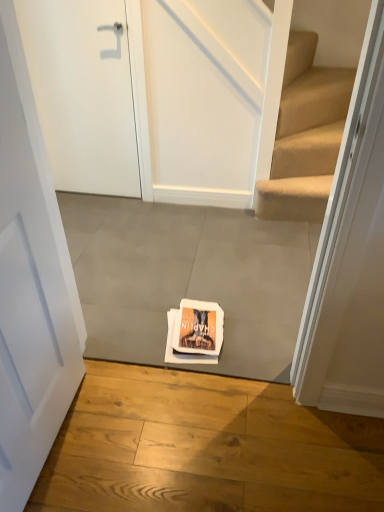
Where is `white matte door at center, which appears as the first door when ordered from the bottom`? The height and width of the screenshot is (512, 384). white matte door at center, which appears as the first door when ordered from the bottom is located at coordinates (31, 286).

Identify the location of white matte door at upper left, placed as the second door when sorted from front to back. [83, 92].

The height and width of the screenshot is (512, 384). I want to click on gray concrete at center, marked as the 1th concrete in a front-to-back arrangement, so click(205, 447).

Can you confirm if gray concrete at center, acting as the first concrete starting from the bottom, is wider than white matte door at center, which is counted as the first door, starting from the front?

Indeed, gray concrete at center, acting as the first concrete starting from the bottom, has a greater width compared to white matte door at center, which is counted as the first door, starting from the front.

In the scene shown: Can you confirm if gray concrete at center, the second concrete when ordered from back to front, is shorter than white matte door at center, which is counted as the first door, starting from the front?

Indeed, gray concrete at center, the second concrete when ordered from back to front, has a lesser height compared to white matte door at center, which is counted as the first door, starting from the front.

How different are the orientations of gray concrete at center, the second concrete when ordered from back to front, and white matte door at center, acting as the 2th door starting from the back, in degrees?

gray concrete at center, the second concrete when ordered from back to front, and white matte door at center, acting as the 2th door starting from the back, are facing 91.7 degrees away from each other.

From a real-world perspective, is gray concrete at center, the 2th concrete in the bottom-to-top sequence, physically located above or below gray concrete at center, acting as the first concrete starting from the bottom?

gray concrete at center, the 2th concrete in the bottom-to-top sequence, is above gray concrete at center, acting as the first concrete starting from the bottom.

Based on their sizes in the image, would you say gray concrete at center, acting as the 1th concrete starting from the back, is bigger or smaller than gray concrete at center, the second concrete when ordered from back to front?

gray concrete at center, acting as the 1th concrete starting from the back, is bigger than gray concrete at center, the second concrete when ordered from back to front.

Is point (293, 302) closer or farther from the camera than point (137, 489)?

Point (293, 302) is farther from the camera than point (137, 489).

Who is taller, white matte door at center, the second door viewed from the top, or gray concrete at center, acting as the 1th concrete starting from the back?

Standing taller between the two is white matte door at center, the second door viewed from the top.

Between white matte door at center, the second door viewed from the top, and gray concrete at center, acting as the 1th concrete starting from the back, which one has smaller width?

white matte door at center, the second door viewed from the top, is thinner.

Considering the sizes of objects white matte door at center, acting as the 2th door starting from the back, and white matte door at upper left, the first door positioned from the back, in the image provided, who is shorter, white matte door at center, acting as the 2th door starting from the back, or white matte door at upper left, the first door positioned from the back,?

Standing shorter between the two is white matte door at upper left, the first door positioned from the back.

Considering the relative sizes of white matte door at center, the second door viewed from the top, and white matte door at upper left, positioned as the 1th door in top-to-bottom order, in the image provided, is white matte door at center, the second door viewed from the top, bigger than white matte door at upper left, positioned as the 1th door in top-to-bottom order,?

Actually, white matte door at center, the second door viewed from the top, might be smaller than white matte door at upper left, positioned as the 1th door in top-to-bottom order.

From the image's perspective, does white matte door at center, acting as the 2th door starting from the back, appear lower than white matte door at upper left, positioned as the 1th door in top-to-bottom order?

Indeed, from the image's perspective, white matte door at center, acting as the 2th door starting from the back, is shown beneath white matte door at upper left, positioned as the 1th door in top-to-bottom order.

Between point (53, 266) and point (40, 21), which one is positioned in front?

The point (53, 266) is closer.

Which of these two, white matte door at upper left, positioned as the 1th door in top-to-bottom order, or gray concrete at center, the second concrete from the top, is thinner?

white matte door at upper left, positioned as the 1th door in top-to-bottom order.

From the image's perspective, relative to gray concrete at center, the second concrete from the top, is white matte door at upper left, positioned as the 1th door in top-to-bottom order, above or below?

From the image's perspective, white matte door at upper left, positioned as the 1th door in top-to-bottom order, appears above gray concrete at center, the second concrete from the top.

Is gray concrete at center, marked as the 1th concrete in a front-to-back arrangement, at the back of white matte door at upper left, placed as the second door when sorted from front to back?

white matte door at upper left, placed as the second door when sorted from front to back, is not turned away from gray concrete at center, marked as the 1th concrete in a front-to-back arrangement.

From a real-world perspective, is white matte door at upper left, placed as the second door when sorted from front to back, physically located above or below gray concrete at center, the second concrete when ordered from back to front?

From a real-world perspective, white matte door at upper left, placed as the second door when sorted from front to back, is physically above gray concrete at center, the second concrete when ordered from back to front.

Is point (14, 253) more distant than point (64, 486)?

No, (14, 253) is closer to viewer.

Can you confirm if white matte door at center, which is counted as the first door, starting from the front, is positioned to the right of gray concrete at center, acting as the first concrete starting from the bottom?

No, white matte door at center, which is counted as the first door, starting from the front, is not to the right of gray concrete at center, acting as the first concrete starting from the bottom.

From a real-world perspective, between white matte door at center, the second door viewed from the top, and gray concrete at center, marked as the 1th concrete in a front-to-back arrangement, who is vertically higher?

white matte door at center, the second door viewed from the top, from a real-world perspective.

Between white matte door at center, acting as the 2th door starting from the back, and gray concrete at center, the second concrete when ordered from back to front, which one has smaller width?

Thinner between the two is white matte door at center, acting as the 2th door starting from the back.

Is white matte door at upper left, which ranks as the 2th door in bottom-to-top order, positioned beyond the bounds of white matte door at center, the second door viewed from the top?

Yes, white matte door at upper left, which ranks as the 2th door in bottom-to-top order, is located beyond the bounds of white matte door at center, the second door viewed from the top.

Visually, is white matte door at upper left, which ranks as the 2th door in bottom-to-top order, positioned to the left or to the right of white matte door at center, acting as the 2th door starting from the back?

Based on their positions, white matte door at upper left, which ranks as the 2th door in bottom-to-top order, is located to the left of white matte door at center, acting as the 2th door starting from the back.

In terms of height, does white matte door at upper left, positioned as the 1th door in top-to-bottom order, look taller or shorter compared to white matte door at center, which appears as the first door when ordered from the bottom?

In the image, white matte door at upper left, positioned as the 1th door in top-to-bottom order, appears to be shorter than white matte door at center, which appears as the first door when ordered from the bottom.

From the gray concrete at center, acting as the first concrete starting from the bottom, count the 1st door to the left and point to it. Please provide its 2D coordinates.

[(31, 286)]

The width and height of the screenshot is (384, 512). I want to click on concrete that appears behind the gray concrete at center, acting as the first concrete starting from the bottom, so click(x=188, y=278).

Considering their positions, is gray concrete at center, acting as the 1th concrete starting from the back, positioned closer to white matte door at center, acting as the 2th door starting from the back, than gray concrete at center, marked as the 1th concrete in a front-to-back arrangement?

gray concrete at center, marked as the 1th concrete in a front-to-back arrangement, is positioned closer to the anchor white matte door at center, acting as the 2th door starting from the back.

From the image, which object appears to be nearer to gray concrete at center, marked as the 1th concrete in a front-to-back arrangement, white matte door at upper left, which ranks as the 2th door in bottom-to-top order, or white matte door at center, which appears as the first door when ordered from the bottom?

Among the two, white matte door at center, which appears as the first door when ordered from the bottom, is located nearer to gray concrete at center, marked as the 1th concrete in a front-to-back arrangement.

Considering their positions, is white matte door at center, acting as the 2th door starting from the back, positioned closer to white matte door at upper left, which ranks as the 2th door in bottom-to-top order, than gray concrete at center, the second concrete when ordered from back to front?

The object closer to white matte door at upper left, which ranks as the 2th door in bottom-to-top order, is white matte door at center, acting as the 2th door starting from the back.

Looking at the image, which one is located closer to white matte door at upper left, which ranks as the 2th door in bottom-to-top order, gray concrete at center, the second concrete when ordered from back to front, or white matte door at center, which appears as the first door when ordered from the bottom?

Among the two, white matte door at center, which appears as the first door when ordered from the bottom, is located nearer to white matte door at upper left, which ranks as the 2th door in bottom-to-top order.

Which object lies nearer to the anchor point gray concrete at center, the first concrete in the top-to-bottom sequence, gray concrete at center, the second concrete when ordered from back to front, or white matte door at center, which appears as the first door when ordered from the bottom?

gray concrete at center, the second concrete when ordered from back to front, lies closer to gray concrete at center, the first concrete in the top-to-bottom sequence, than the other object.

Based on their spatial positions, is gray concrete at center, acting as the first concrete starting from the bottom, or white matte door at upper left, placed as the second door when sorted from front to back, further from white matte door at center, which is counted as the first door, starting from the front?

white matte door at upper left, placed as the second door when sorted from front to back.

Based on the photo, when comparing their distances from gray concrete at center, the first concrete in the top-to-bottom sequence, does white matte door at upper left, the first door positioned from the back, or gray concrete at center, acting as the first concrete starting from the bottom, seem further?

Among the two, white matte door at upper left, the first door positioned from the back, is located further to gray concrete at center, the first concrete in the top-to-bottom sequence.

Which object lies further to the anchor point gray concrete at center, which ranks as the second concrete in front-to-back order, white matte door at center, acting as the 2th door starting from the back, or gray concrete at center, the second concrete when ordered from back to front?

white matte door at center, acting as the 2th door starting from the back, is positioned further to the anchor gray concrete at center, which ranks as the second concrete in front-to-back order.

Locate an element on the screen. The image size is (384, 512). concrete positioned between white matte door at center, the second door viewed from the top, and gray concrete at center, acting as the 1th concrete starting from the back, from near to far is located at coordinates (205, 447).

Locate an element on the screen. concrete between white matte door at upper left, placed as the second door when sorted from front to back, and gray concrete at center, the second concrete from the top, in the vertical direction is located at coordinates (188, 278).